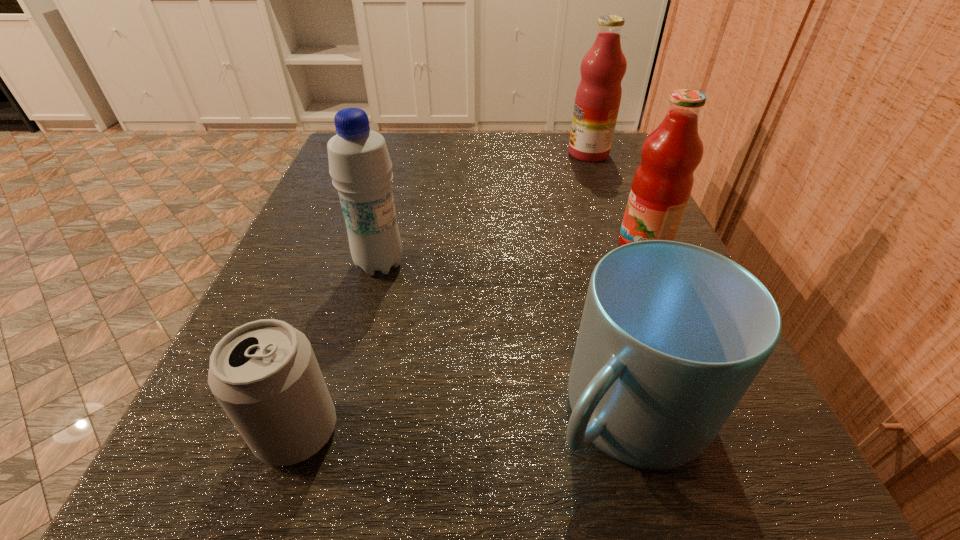
You are a GUI agent. You are given a task and a screenshot of the screen. Output one action in this format:
    pyautogui.click(x=<x>, y=<y>)
    Task: Click on the empty space between the water bottle and the farthest object
    
    Given the screenshot: What is the action you would take?
    484,209

Identify the location of free area in between the shortest object and the nearer fruit juice. Image resolution: width=960 pixels, height=540 pixels. (470, 339).

You are a GUI agent. You are given a task and a screenshot of the screen. Output one action in this format:
    pyautogui.click(x=<x>, y=<y>)
    Task: Click on the vacant space that's between the nearer fruit juice and the can
    This screenshot has width=960, height=540.
    Given the screenshot: What is the action you would take?
    pyautogui.click(x=470, y=339)

The image size is (960, 540). I want to click on the second closest object relative to the farthest object, so click(360, 166).

What are the coordinates of `object that is the closest to the shortest object` in the screenshot? It's located at (360, 166).

You are a GUI agent. You are given a task and a screenshot of the screen. Output one action in this format:
    pyautogui.click(x=<x>, y=<y>)
    Task: Click on the free location that satisfies the following two spatial constraints: 1. on the label of the farther fruit juice; 2. on the front side of the second shortest object
    
    Given the screenshot: What is the action you would take?
    pyautogui.click(x=690, y=412)

Locate an element on the screen. vacant space that satisfies the following two spatial constraints: 1. on the back side of the shortest object; 2. on the left side of the mug is located at coordinates (303, 412).

At what (x,y) coordinates should I click in order to perform the action: click on free space that satisfies the following two spatial constraints: 1. on the label of the farthest object; 2. on the front side of the can. Please return your answer as a coordinate pair (x, y). Looking at the image, I should click on (698, 431).